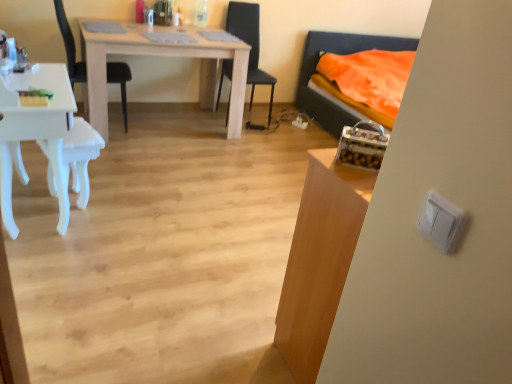
Where is `vacant space in front of white glossy armchair at lower left`? The width and height of the screenshot is (512, 384). vacant space in front of white glossy armchair at lower left is located at coordinates pos(59,225).